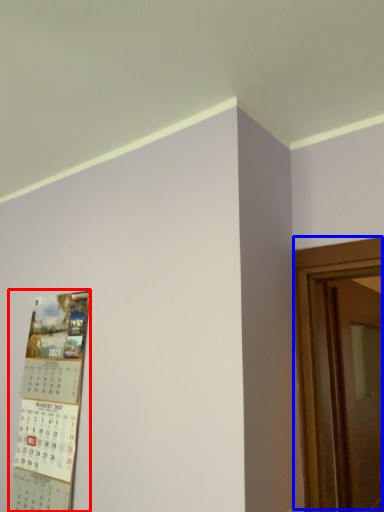
Question: Among these objects, which one is farthest to the camera, poster (highlighted by a red box) or door (highlighted by a blue box)?

Choices:
 (A) poster
 (B) door

Answer: (B)